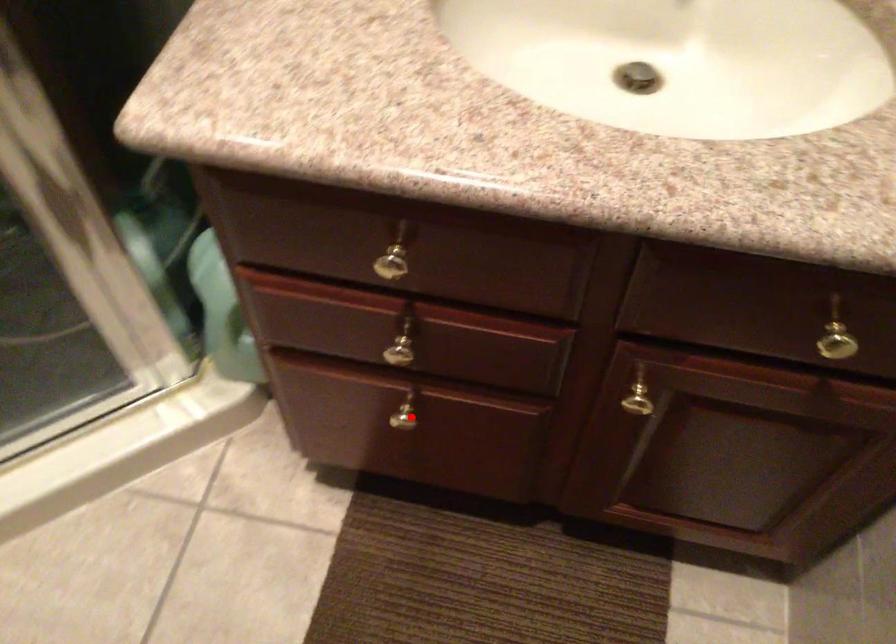
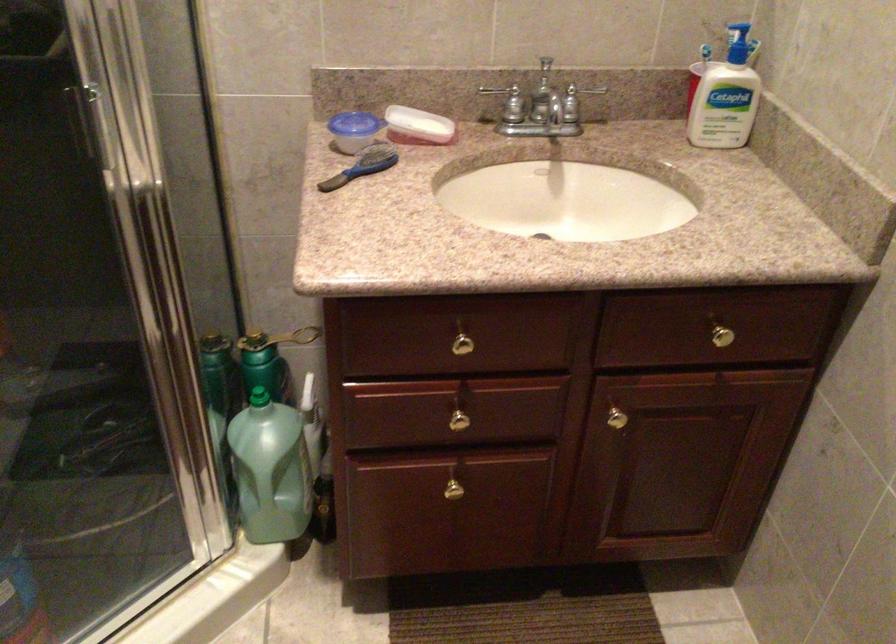
Question: I am providing you with two images of the same scene from different viewpoints. Image1 has a red point marked. In image2, the corresponding 3D location appears at what relative position? Reply with the corresponding letter.

Choices:
 (A) Closer
 (B) Farther

Answer: (B)